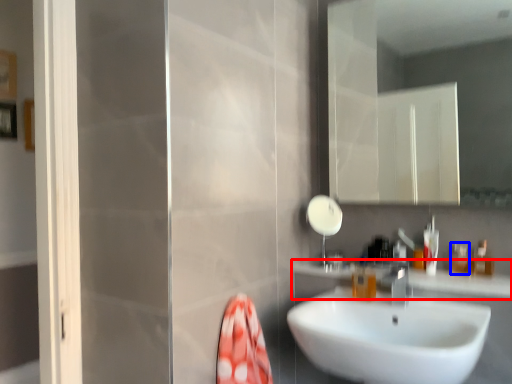
Question: Which object appears farthest to the camera in this image, counter top (highlighted by a red box) or toiletry (highlighted by a blue box)?

Choices:
 (A) counter top
 (B) toiletry

Answer: (B)